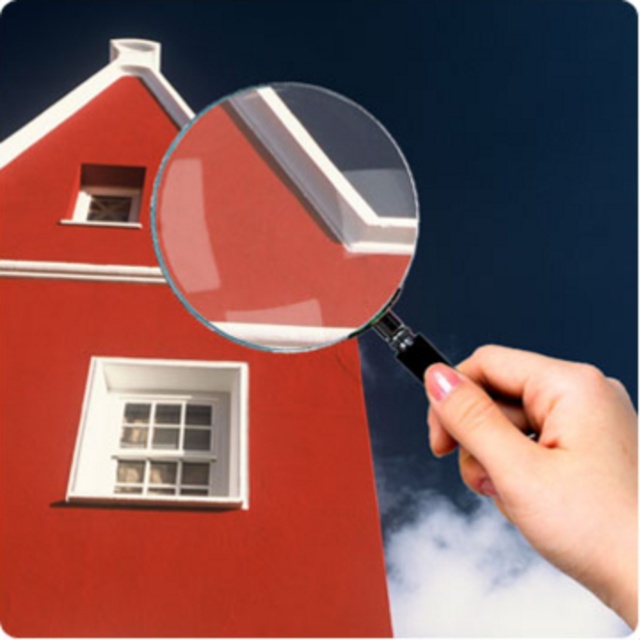
Question: Considering the relative positions of transparent plastic magnifying glass at upper center and pink polished fingernails at upper right in the image provided, where is transparent plastic magnifying glass at upper center located with respect to pink polished fingernails at upper right?

Choices:
 (A) below
 (B) above

Answer: (B)

Question: Which object appears closest to the camera in this image?

Choices:
 (A) transparent plastic magnifying glass at upper center
 (B) pink polished fingernails at upper right

Answer: (B)

Question: Can you confirm if transparent plastic magnifying glass at upper center is positioned below pink polished fingernails at upper right?

Choices:
 (A) yes
 (B) no

Answer: (B)

Question: Is transparent plastic magnifying glass at upper center bigger than pink polished fingernails at upper right?

Choices:
 (A) yes
 (B) no

Answer: (A)

Question: Which point appears closest to the camera in this image?

Choices:
 (A) (442, 429)
 (B) (371, 205)

Answer: (A)